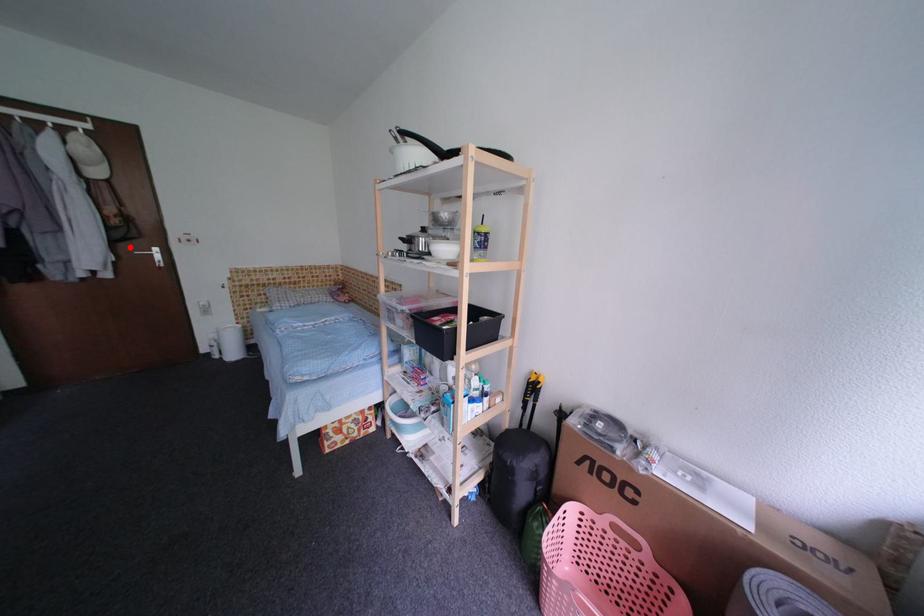
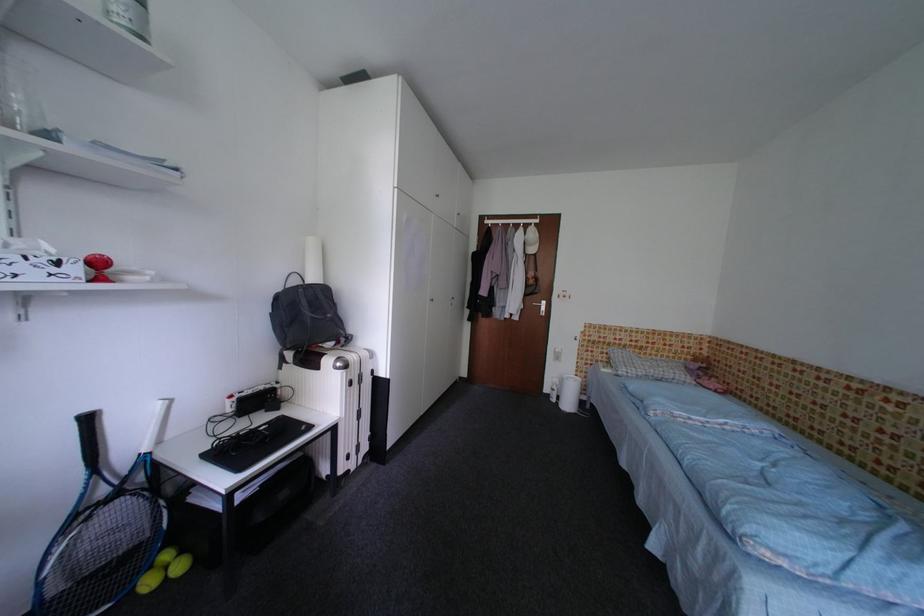
Find the pixel in the second image that matches the highlighted location in the first image.

(536, 300)